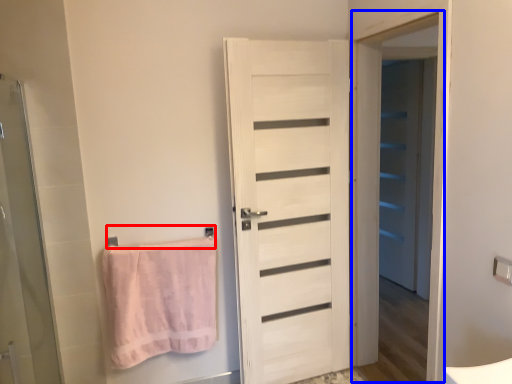
Question: Among these objects, which one is farthest to the camera, towel bar (highlighted by a red box) or screen door (highlighted by a blue box)?

Choices:
 (A) towel bar
 (B) screen door

Answer: (A)